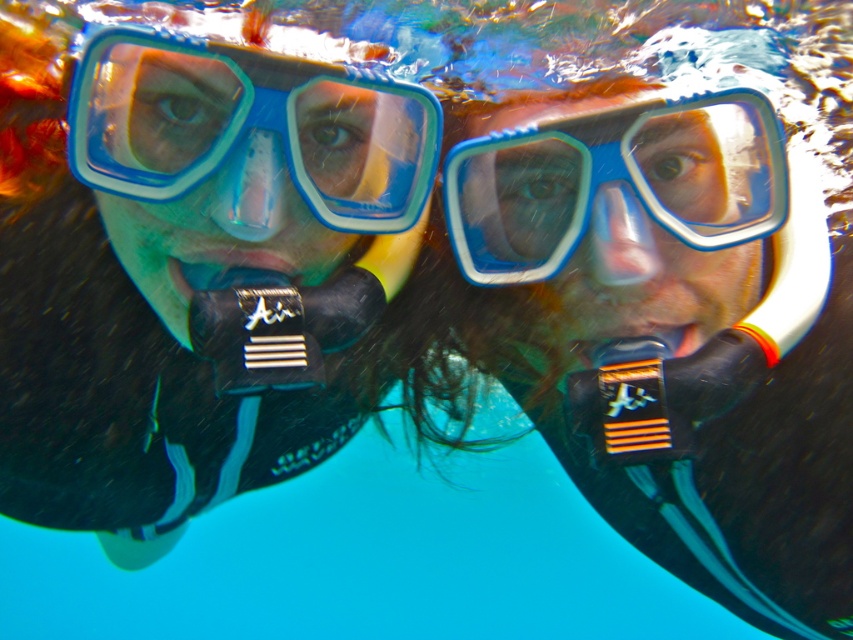
Looking at this image, between blue plastic goggles at center and blue rubber goggles at center, which one has less height?

Standing shorter between the two is blue plastic goggles at center.

Can you confirm if blue plastic goggles at center is positioned to the left of blue rubber goggles at center?

Indeed, blue plastic goggles at center is positioned on the left side of blue rubber goggles at center.

Between point (238, 120) and point (492, 259), which one is positioned behind?

The point (492, 259) is behind.

The width and height of the screenshot is (853, 640). What are the coordinates of `blue plastic goggles at center` in the screenshot? It's located at (248, 131).